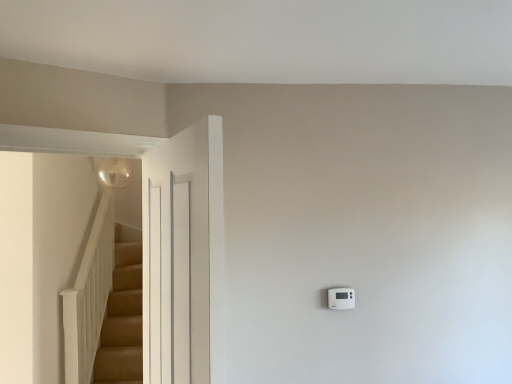
Describe the element at coordinates (184, 257) in the screenshot. The image size is (512, 384). I see `white painted wood door at left` at that location.

Image resolution: width=512 pixels, height=384 pixels. In order to click on white painted wood door at left in this screenshot , I will do `click(184, 257)`.

What is the approximate height of white plastic thermostat at right?

4.41 inches.

What do you see at coordinates (341, 298) in the screenshot? The image size is (512, 384). I see `white plastic thermostat at right` at bounding box center [341, 298].

Locate an element on the screen. white plastic thermostat at right is located at coordinates (341, 298).

What are the coordinates of `white painted wood door at left` in the screenshot? It's located at (184, 257).

Does white painted wood door at left appear on the left side of white plastic thermostat at right?

Yes, white painted wood door at left is to the left of white plastic thermostat at right.

Considering their positions, is white painted wood door at left located in front of or behind white plastic thermostat at right?

white painted wood door at left is positioned closer to the viewer than white plastic thermostat at right.

Which is behind, point (172, 247) or point (328, 297)?

Point (328, 297)

From the image's perspective, which is below, white painted wood door at left or white plastic thermostat at right?

white plastic thermostat at right, from the image's perspective.

From a real-world perspective, is white painted wood door at left above or below white plastic thermostat at right?

From a real-world perspective, white painted wood door at left is physically above white plastic thermostat at right.

Considering the relative sizes of white painted wood door at left and white plastic thermostat at right in the image provided, is white painted wood door at left wider than white plastic thermostat at right?

Yes, white painted wood door at left is wider than white plastic thermostat at right.

Is white painted wood door at left taller than white plastic thermostat at right?

Indeed, white painted wood door at left has a greater height compared to white plastic thermostat at right.

Considering the sizes of objects white painted wood door at left and white plastic thermostat at right in the image provided, who is smaller, white painted wood door at left or white plastic thermostat at right?

With smaller size is white plastic thermostat at right.

Does white painted wood door at left contain white plastic thermostat at right?

No, white plastic thermostat at right is located outside of white painted wood door at left.

Looking at this image, is white painted wood door at left next to white plastic thermostat at right?

white painted wood door at left and white plastic thermostat at right are not in contact.

Could you tell me if white painted wood door at left is turned towards white plastic thermostat at right?

No, white painted wood door at left is not aimed at white plastic thermostat at right.

At what (x,y) coordinates should I click in order to perform the action: click on door on the left side of white plastic thermostat at right. Please return your answer as a coordinate pair (x, y). The width and height of the screenshot is (512, 384). Looking at the image, I should click on (184, 257).

Is white plastic thermostat at right to the left of white painted wood door at left from the viewer's perspective?

No, white plastic thermostat at right is not to the left of white painted wood door at left.

Which is in front, white plastic thermostat at right or white painted wood door at left?

white painted wood door at left is in front.

Does point (354, 292) lie behind point (196, 196)?

That is True.

From the image's perspective, is white plastic thermostat at right on top of white painted wood door at left?

No, from the image's perspective, white plastic thermostat at right is not above white painted wood door at left.

From a real-world perspective, is white plastic thermostat at right on top of white painted wood door at left?

No.

In terms of width, does white plastic thermostat at right look wider or thinner when compared to white painted wood door at left?

Considering their sizes, white plastic thermostat at right looks slimmer than white painted wood door at left.

Which of these two, white plastic thermostat at right or white painted wood door at left, stands shorter?

white plastic thermostat at right is shorter.

Considering the relative sizes of white plastic thermostat at right and white painted wood door at left in the image provided, is white plastic thermostat at right smaller than white painted wood door at left?

Indeed, white plastic thermostat at right has a smaller size compared to white painted wood door at left.

Can we say white plastic thermostat at right lies outside white painted wood door at left?

Indeed, white plastic thermostat at right is completely outside white painted wood door at left.

Is white plastic thermostat at right touching white painted wood door at left?

No, white plastic thermostat at right is not beside white painted wood door at left.

Is white plastic thermostat at right positioned with its back to white painted wood door at left?

white plastic thermostat at right does not have its back to white painted wood door at left.

How different are the orientations of white plastic thermostat at right and white painted wood door at left in degrees?

The facing directions of white plastic thermostat at right and white painted wood door at left are 73.1 degrees apart.

This screenshot has width=512, height=384. I want to click on door in front of the white plastic thermostat at right, so click(x=184, y=257).

This screenshot has width=512, height=384. I want to click on door to the left of white plastic thermostat at right, so click(x=184, y=257).

Find the location of a particular element. Image resolution: width=512 pixels, height=384 pixels. door above the white plastic thermostat at right (from the image's perspective) is located at coordinates (184, 257).